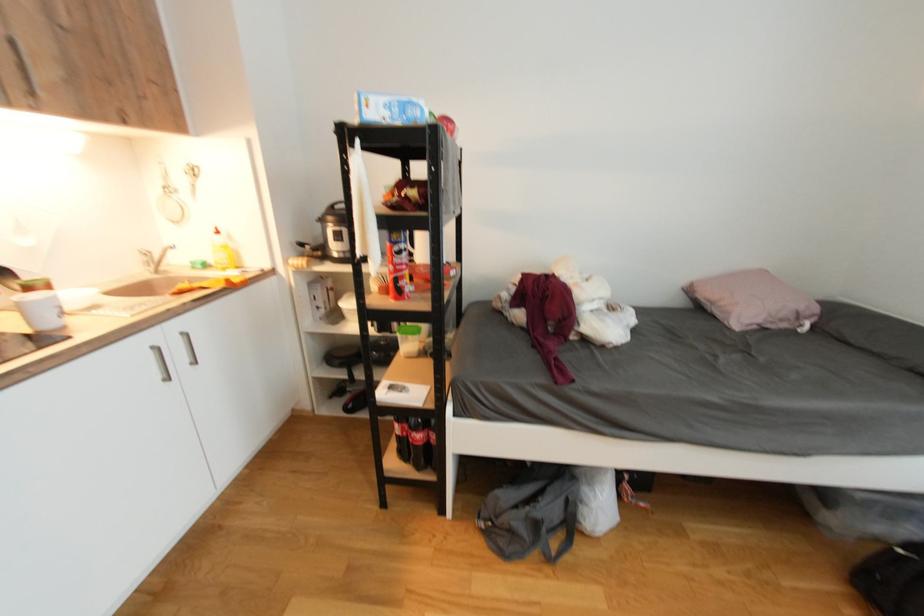
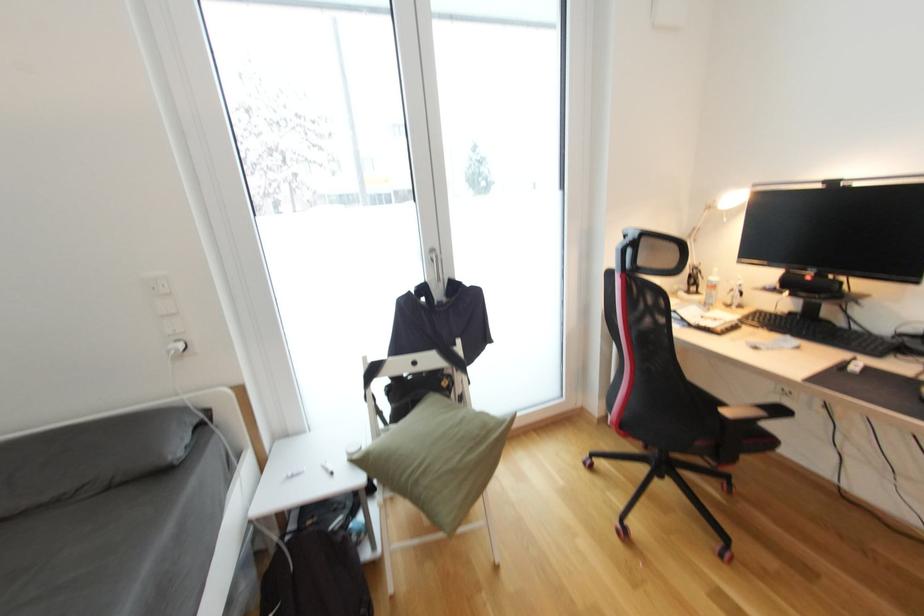
The images are taken continuously from a first-person perspective. In which direction is your viewpoint rotating?

The camera's rotation is toward right-down.